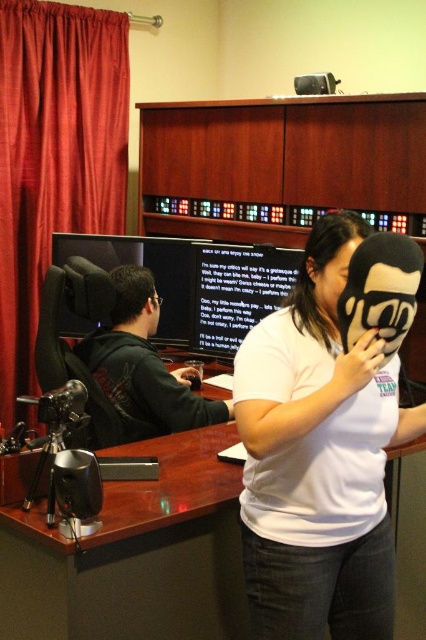
Question: Among these objects, which one is nearest to the camera?

Choices:
 (A) white matte face at center
 (B) matte black mask at center

Answer: (A)

Question: From the image, what is the correct spatial relationship of wooden desk at center in relation to black glossy computer monitor at center?

Choices:
 (A) above
 (B) below

Answer: (B)

Question: Which point is farther from the camera taking this photo?

Choices:
 (A) (112, 244)
 (B) (255, 250)

Answer: (A)

Question: Does white matte mask at center come behind matte black mask at center?

Choices:
 (A) no
 (B) yes

Answer: (A)

Question: Where is white matte mask at center located in relation to matte black mask at center in the image?

Choices:
 (A) right
 (B) left

Answer: (A)

Question: Which point is closer to the camera?

Choices:
 (A) matte black mask at center
 (B) wooden desk at center
 (C) matte black monitor at left
 (D) white matte face at center

Answer: (D)